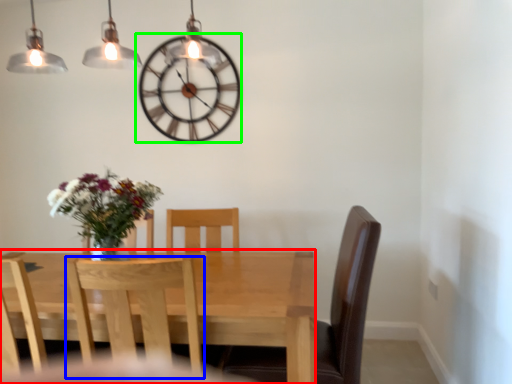
Question: Which object is positioned farthest from kitchen & dining room table (highlighted by a red box)? Select from chair (highlighted by a blue box) and wall clock (highlighted by a green box).

Choices:
 (A) chair
 (B) wall clock

Answer: (B)